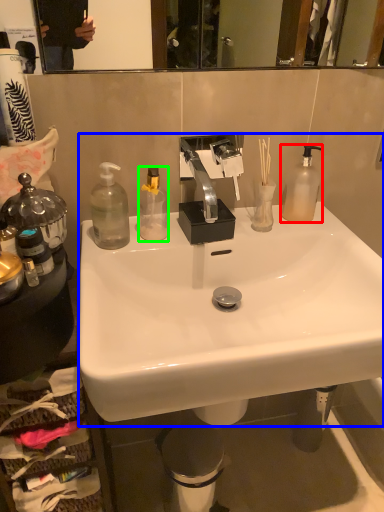
Question: Which is farther away from bottle (highlighted by a red box)? sink (highlighted by a blue box) or bottle (highlighted by a green box)?

Choices:
 (A) sink
 (B) bottle

Answer: (B)